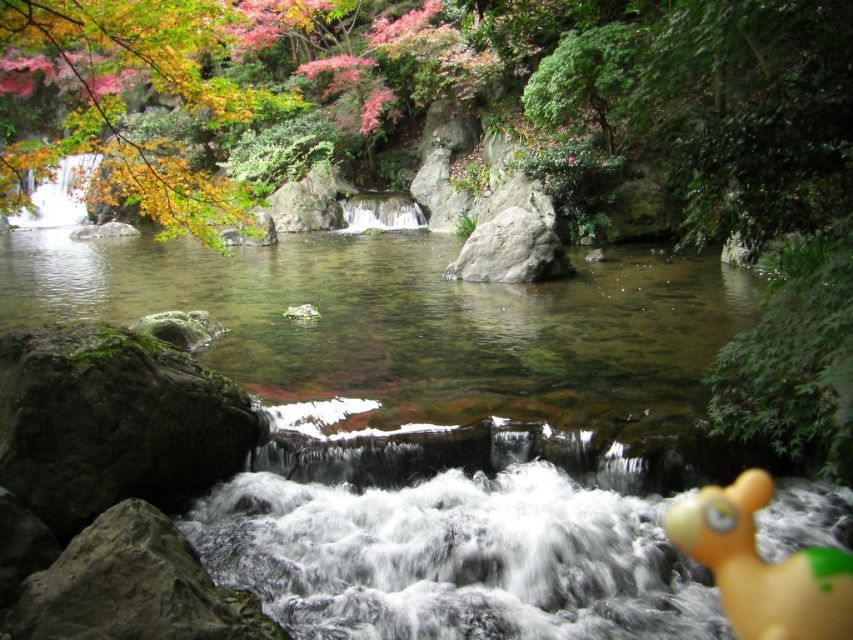
You are standing at the edge of the pool in the serene natural scene. You see the yellow rubber duck at lower right. Where exactly is the yellow rubber duck located in terms of coordinates?

The yellow rubber duck at lower right is located at point coordinates of (762, 566).

You are standing at the edge of the waterfall and see the yellow rubber duck at lower right and the gray rough rock at center. Which object is nearer to you?

The yellow rubber duck at lower right is closer to the viewer than the gray rough rock at center, so the yellow rubber duck at lower right is nearer to you.